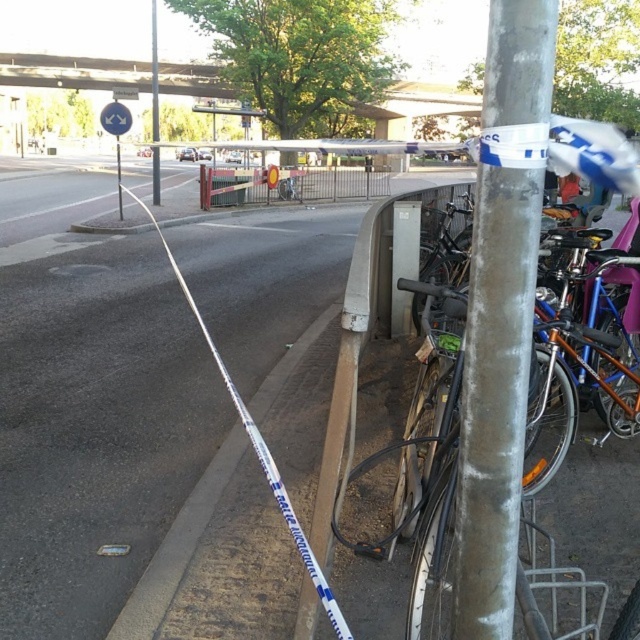
Question: Does silver metallic pole at upper center appear under white plastic street sign at upper center?

Choices:
 (A) no
 (B) yes

Answer: (A)

Question: Which of these objects is positioned farthest from the silver metallic pole at center?

Choices:
 (A) gray concrete curb at lower left
 (B) silver metallic pole at upper center
 (C) white plastic street sign at upper center

Answer: (C)

Question: Observing the image, what is the correct spatial positioning of silver metallic pole at center in reference to white plastic street sign at upper center?

Choices:
 (A) left
 (B) right

Answer: (B)

Question: Considering the real-world distances, which object is closest to the silver metallic pole at center?

Choices:
 (A) silver metallic pole at upper center
 (B) white plastic street sign at upper center

Answer: (A)

Question: Where is silver metallic pole at upper center located in relation to white plastic street sign at upper center in the image?

Choices:
 (A) below
 (B) above

Answer: (B)

Question: Which object is positioned farthest from the silver metallic pole at upper center?

Choices:
 (A) white plastic street sign at upper center
 (B) gray concrete curb at lower left
 (C) silver metallic pole at center

Answer: (B)